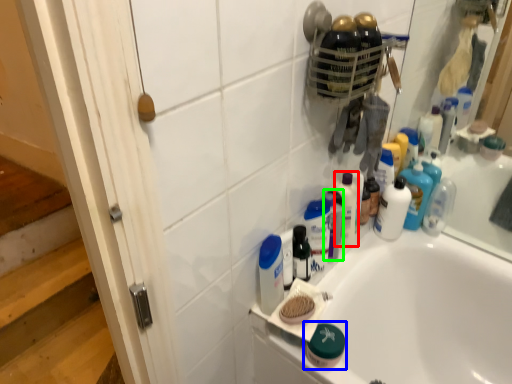
Question: Which object is positioned closest to toiletry (highlighted by a red box)? Select from toiletry (highlighted by a blue box) and toiletry (highlighted by a green box).

Choices:
 (A) toiletry
 (B) toiletry

Answer: (B)